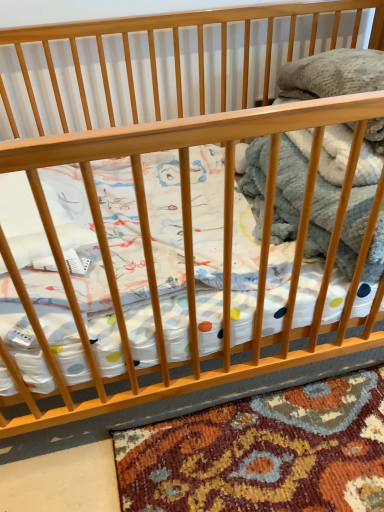
What do you see at coordinates (262, 452) in the screenshot?
I see `textured wool rug at lower center` at bounding box center [262, 452].

The width and height of the screenshot is (384, 512). What are the coordinates of `textured wool rug at lower center` in the screenshot? It's located at (262, 452).

Identify the location of textured wool rug at lower center. (262, 452).